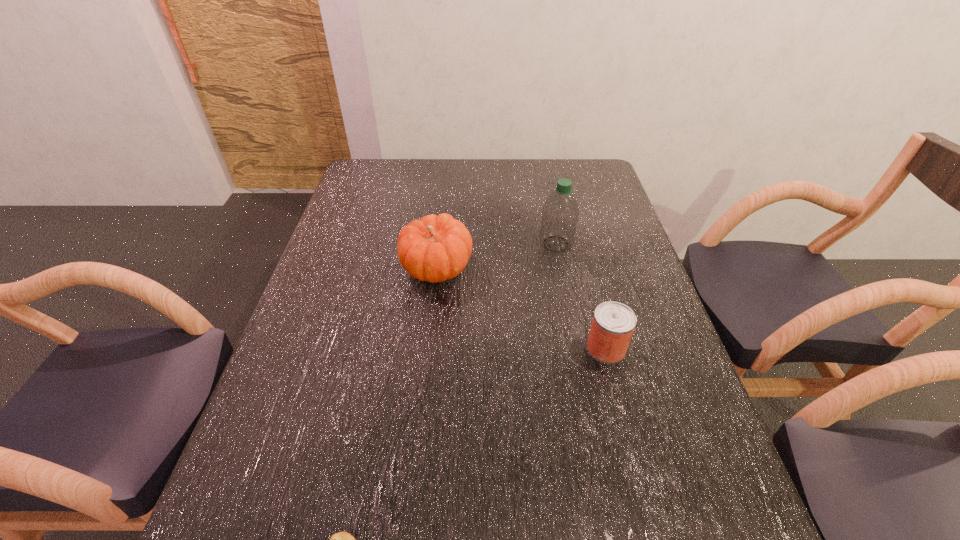
Identify the location of water bottle. (560, 213).

Image resolution: width=960 pixels, height=540 pixels. What are the coordinates of `the third shortest object` in the screenshot? It's located at (436, 248).

Where is `can`? The height and width of the screenshot is (540, 960). can is located at coordinates (613, 323).

Locate an element on the screen. The image size is (960, 540). vacant space located on the back of the water bottle is located at coordinates (546, 198).

Locate an element on the screen. vacant area situated 0.340m on the front of the second tallest object is located at coordinates (421, 409).

Locate an element on the screen. This screenshot has height=540, width=960. vacant space located 0.340m on the left of the third farthest object is located at coordinates (444, 348).

You are a GUI agent. You are given a task and a screenshot of the screen. Output one action in this format:
    pyautogui.click(x=<x>, y=<y>)
    Task: Click on the object present at the right edge
    This screenshot has height=540, width=960.
    Given the screenshot: What is the action you would take?
    pyautogui.click(x=613, y=323)

Identify the location of vacant point at the far edge. (468, 179).

The height and width of the screenshot is (540, 960). What are the coordinates of `blank area at the near edge` in the screenshot? It's located at (457, 538).

This screenshot has height=540, width=960. What are the coordinates of `vacant region at the left edge of the desktop` in the screenshot? It's located at (332, 347).